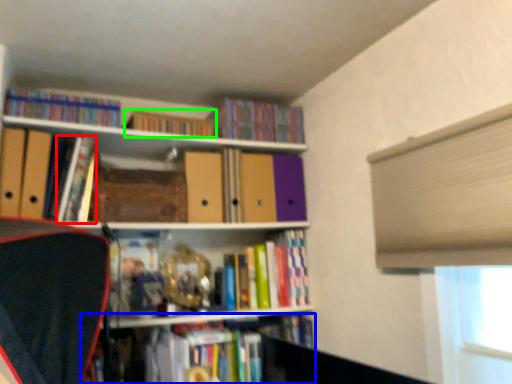
Question: Based on their relative distances, which object is farther from book (highlighted by a red box)? Choose from book (highlighted by a blue box) and book (highlighted by a green box).

Choices:
 (A) book
 (B) book

Answer: (A)